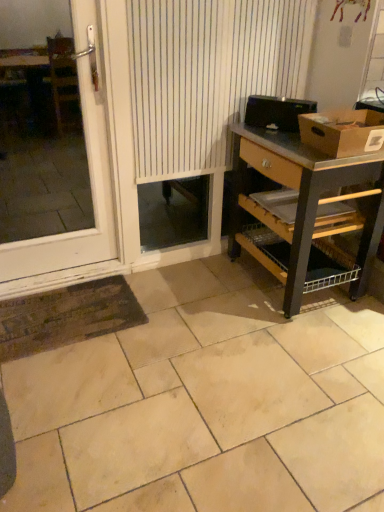
Question: Can you see wooden desk at right touching beige ceramic tile at center?

Choices:
 (A) no
 (B) yes

Answer: (A)

Question: From the image's perspective, would you say wooden desk at right is positioned over beige ceramic tile at center?

Choices:
 (A) yes
 (B) no

Answer: (A)

Question: From a real-world perspective, is wooden desk at right over beige ceramic tile at center?

Choices:
 (A) yes
 (B) no

Answer: (A)

Question: Does wooden desk at right have a lesser height compared to beige ceramic tile at center?

Choices:
 (A) yes
 (B) no

Answer: (B)

Question: Can you confirm if wooden desk at right is smaller than beige ceramic tile at center?

Choices:
 (A) no
 (B) yes

Answer: (B)

Question: Considering the relative sizes of wooden desk at right and beige ceramic tile at center in the image provided, is wooden desk at right bigger than beige ceramic tile at center?

Choices:
 (A) no
 (B) yes

Answer: (A)

Question: Can you confirm if white plastic door at left is bigger than beige ceramic tile at center?

Choices:
 (A) no
 (B) yes

Answer: (A)

Question: Is the position of white plastic door at left less distant than that of beige ceramic tile at center?

Choices:
 (A) yes
 (B) no

Answer: (B)

Question: Does white plastic door at left have a lesser height compared to beige ceramic tile at center?

Choices:
 (A) no
 (B) yes

Answer: (A)

Question: Is white plastic door at left facing towards beige ceramic tile at center?

Choices:
 (A) yes
 (B) no

Answer: (B)

Question: From the image's perspective, is white plastic door at left beneath beige ceramic tile at center?

Choices:
 (A) no
 (B) yes

Answer: (A)

Question: From the image's perspective, is white plastic door at left above beige ceramic tile at center?

Choices:
 (A) no
 (B) yes

Answer: (B)

Question: Does beige ceramic tile at center have a larger size compared to white striped curtain at center?

Choices:
 (A) yes
 (B) no

Answer: (A)